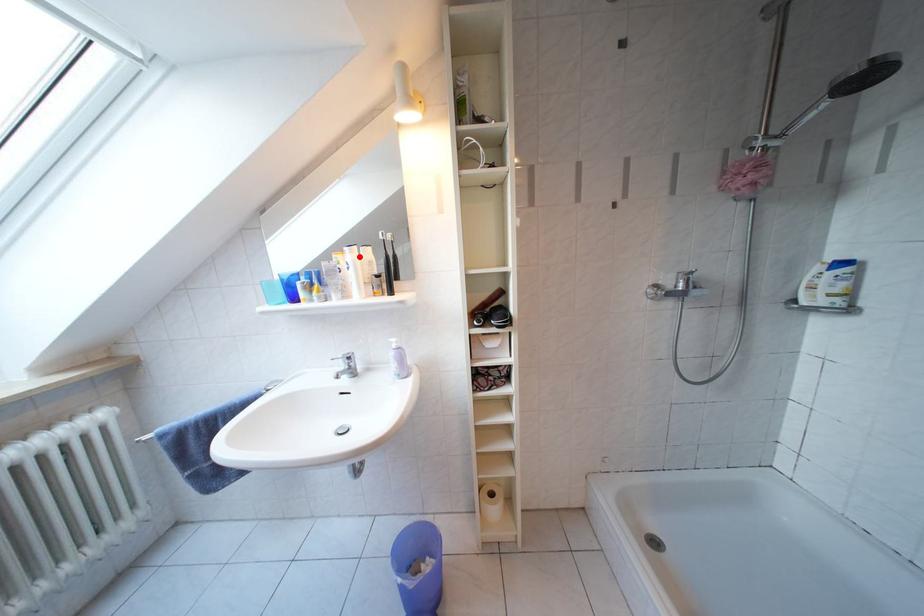
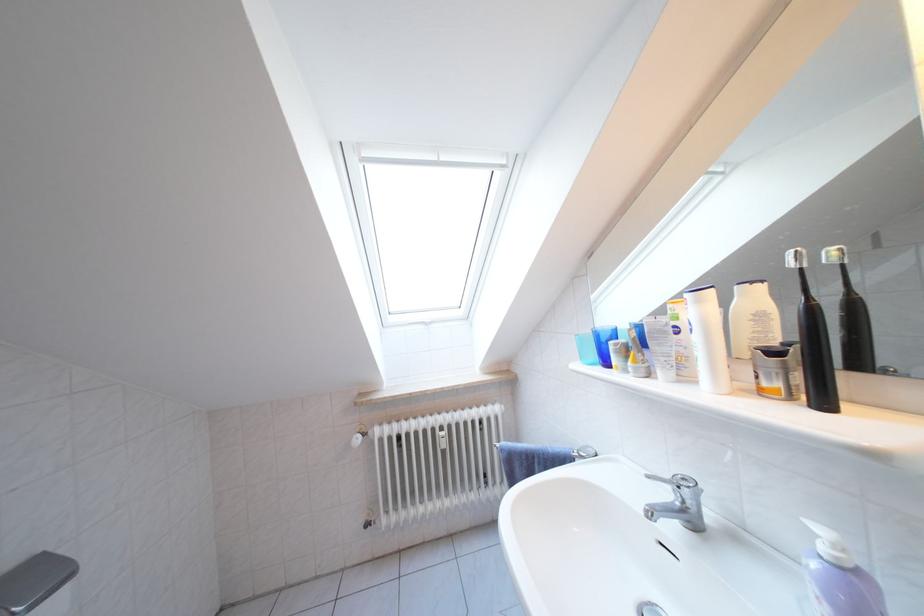
The point at the highlighted location is marked in the first image. Where is the corresponding point in the second image?

(708, 306)